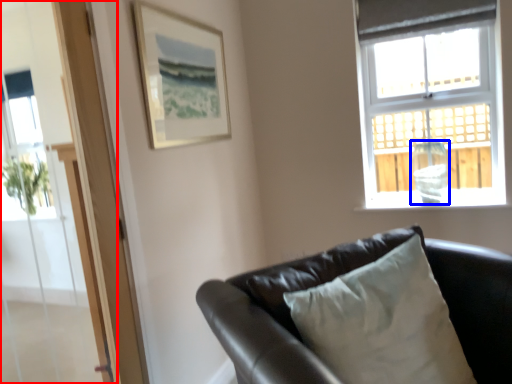
Question: Which of the following is the farthest to the observer, screen door (highlighted by a red box) or glass vase (highlighted by a blue box)?

Choices:
 (A) screen door
 (B) glass vase

Answer: (B)